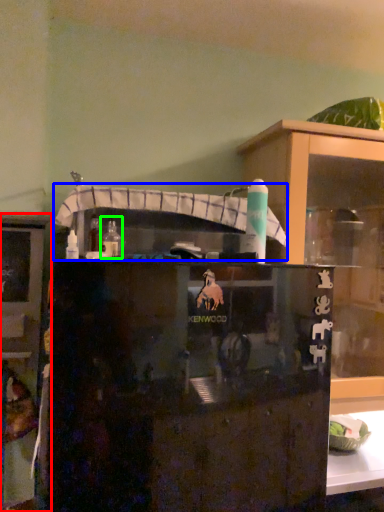
Question: Which is nearer to the cabinetry (highlighted by a red box)? shelf (highlighted by a blue box) or bottle (highlighted by a green box).

Choices:
 (A) shelf
 (B) bottle

Answer: (A)